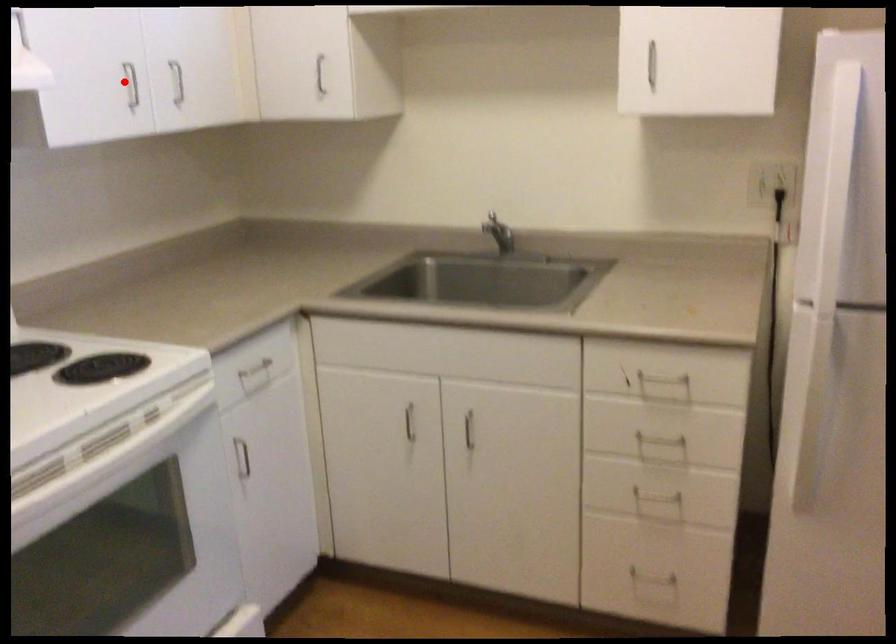
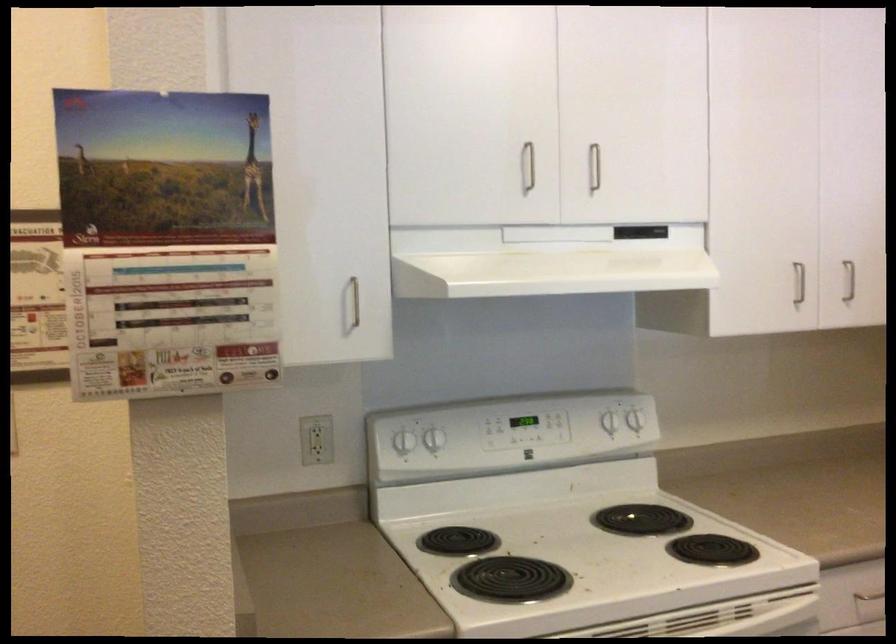
Locate, in the second image, the point that corresponds to the highlighted location in the first image.

(798, 283)